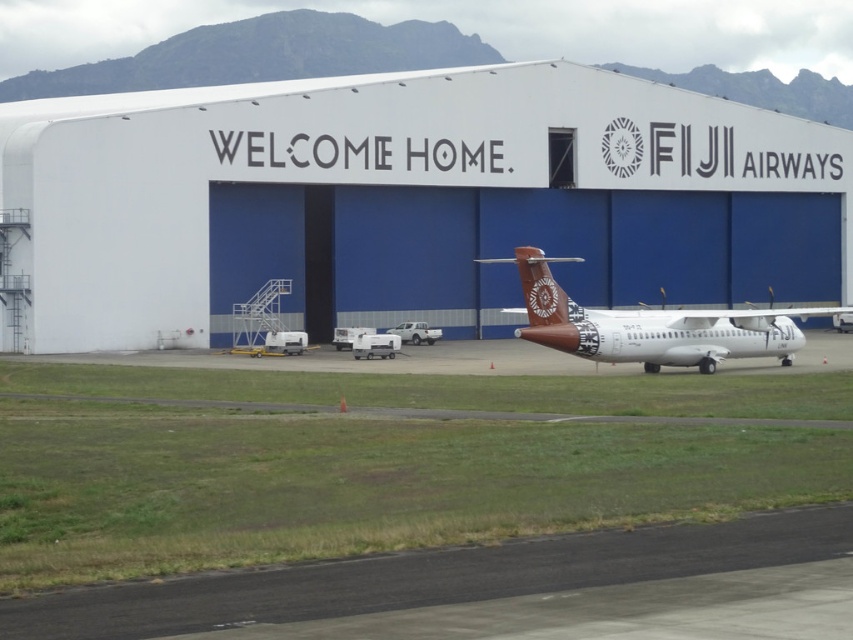
You are a pilot who needs to park your brown matte airplane at center in the airport. The white smooth hangar at center is available for storage. Can your airplane fit inside the hangar?

The white smooth hangar at center is bigger than brown matte airplane at center, so yes, the brown matte airplane at center can fit inside the white smooth hangar at center.

You are a pilot approaching the runway for landing. From your perspective in the air, which object would appear closer to you, the white smooth hangar at center or the black asphalt runway at lower center?

The black asphalt runway at lower center would appear closer to you because it is positioned lower in the image, which typically corresponds to being nearer in perspective.